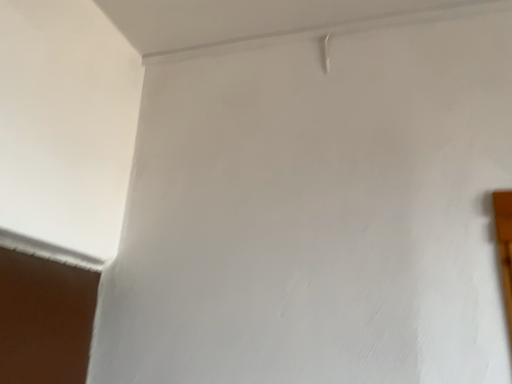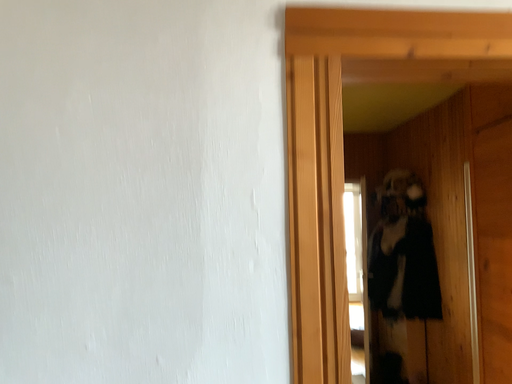
Question: Which way did the camera rotate in the video?

Choices:
 (A) rotated left
 (B) rotated right

Answer: (B)